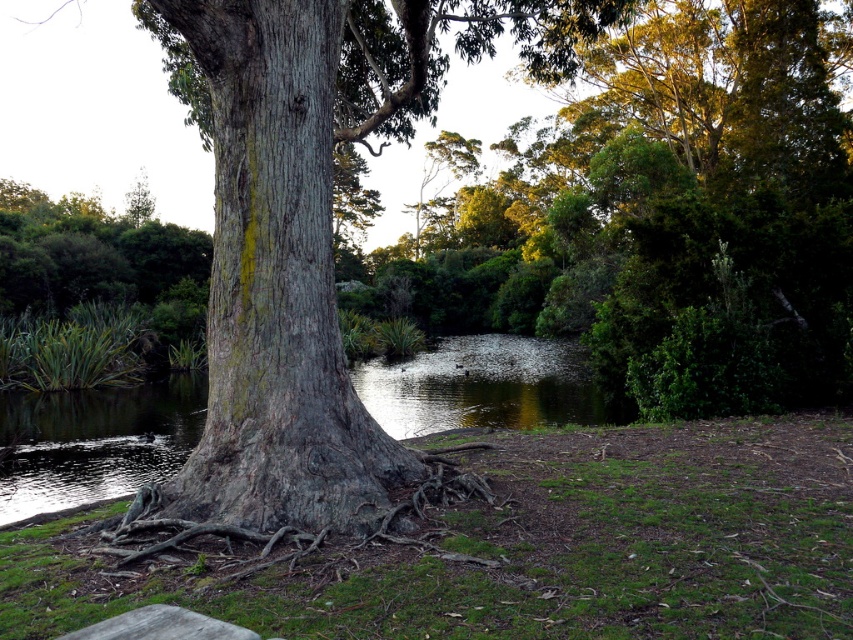
You are standing at the point closest to the tree trunk. Which of the two points, point (329, 186) or point (132, 614), is farther away from you?

Point (329, 186) is farther away because it is behind point (132, 614), which is closer to the tree trunk.

You are sitting on the smooth gray stone bench at lower left and want to look at the gray rough bark tree trunk at center. In which direction should you turn your head?

The gray rough bark tree trunk at center is positioned on the left side of the smooth gray stone bench at lower left, so you should turn your head to the left to look at it.

You are standing in the natural setting shown. You want to take a photo of the gray rough bark tree trunk at center without the greenish reflective water at center appearing in the reflection. Is this possible?

The gray rough bark tree trunk at center is positioned over greenish reflective water at center, so the water reflects the tree trunk. Therefore, it might be challenging to avoid the reflection of the greenish reflective water at center in your photo.